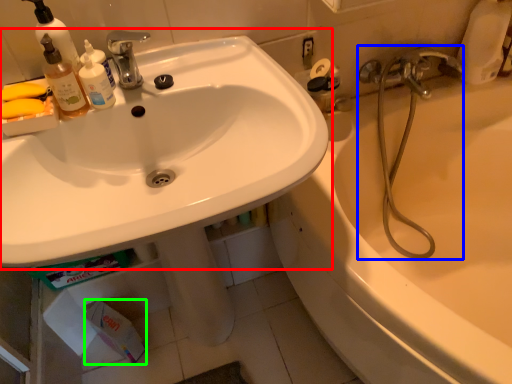
Question: Which is farther away from sink (highlighted by a red box)? plumbing fixture (highlighted by a blue box) or toilet paper (highlighted by a green box)?

Choices:
 (A) plumbing fixture
 (B) toilet paper

Answer: (B)